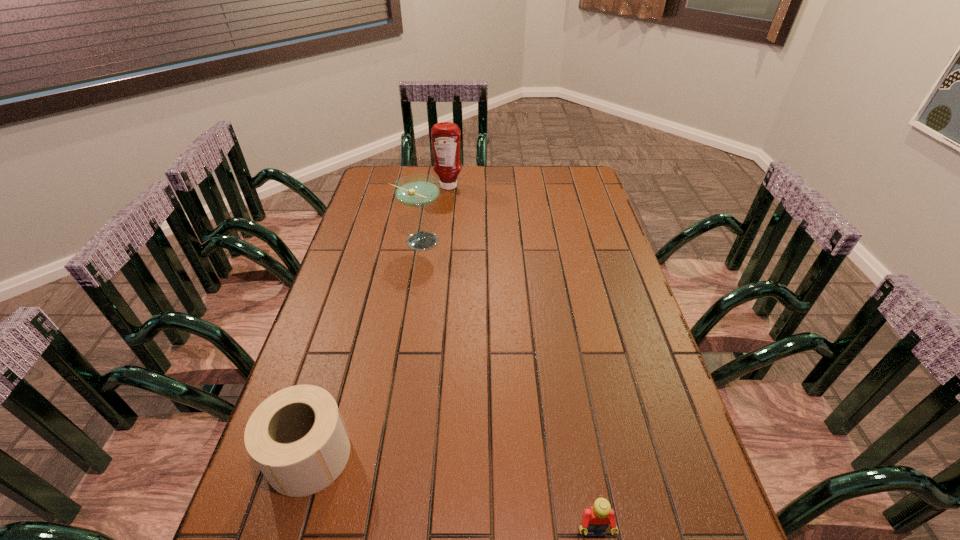
In order to click on free spot that satisfies the following two spatial constraints: 1. on the back side of the farthest object; 2. on the left side of the third nearest object in this screenshot , I will do `click(428, 186)`.